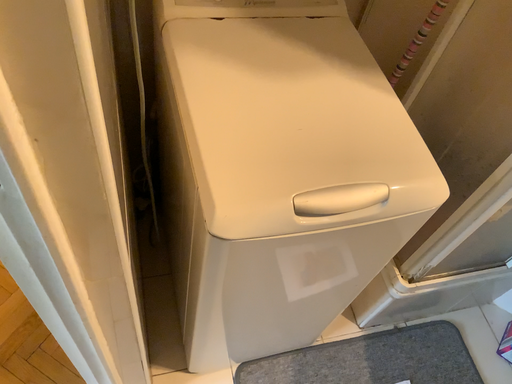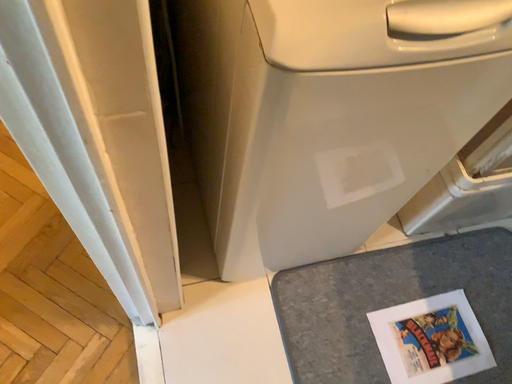
Question: How did the camera likely rotate when shooting the video?

Choices:
 (A) rotated upward
 (B) rotated downward

Answer: (B)